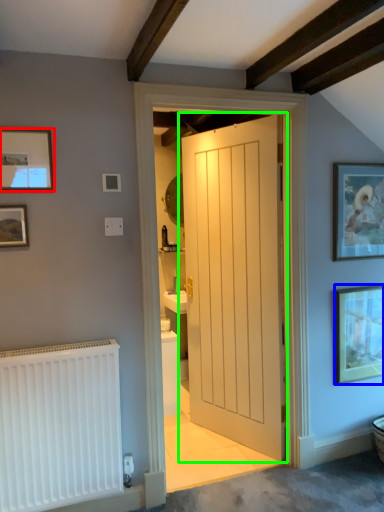
Question: Estimate the real-world distances between objects in this image. Which object is closer to picture frame (highlighted by a red box), picture frame (highlighted by a blue box) or door (highlighted by a green box)?

Choices:
 (A) picture frame
 (B) door

Answer: (B)